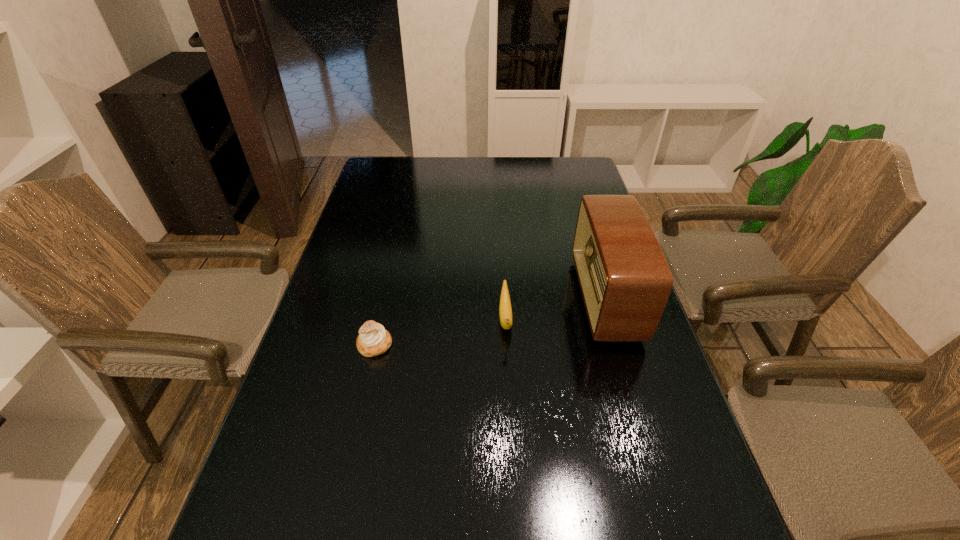
This screenshot has width=960, height=540. Find the location of `the tallest object`. the tallest object is located at coordinates (625, 280).

You are a GUI agent. You are given a task and a screenshot of the screen. Output one action in this format:
    pyautogui.click(x=<x>, y=<y>)
    Task: Click on the radio receiver
    The image size is (960, 540).
    Given the screenshot: What is the action you would take?
    pyautogui.click(x=625, y=280)

Identify the location of banana. (505, 310).

The width and height of the screenshot is (960, 540). Find the location of `pastry`. pastry is located at coordinates (373, 339).

At what (x,y) coordinates should I click in order to perform the action: click on the leftmost object. Please return your answer as a coordinate pair (x, y). Looking at the image, I should click on (373, 339).

Image resolution: width=960 pixels, height=540 pixels. Find the location of `blank space located on the front-facing side of the rightmost object`. blank space located on the front-facing side of the rightmost object is located at coordinates (506, 299).

I want to click on free spot located 0.100m on the front-facing side of the rightmost object, so click(x=542, y=299).

Find the location of `blank space located 0.150m on the front-facing side of the rightmost object`. blank space located 0.150m on the front-facing side of the rightmost object is located at coordinates (524, 299).

This screenshot has width=960, height=540. What are the coordinates of `vacant space located 0.130m at the stem of the banana` in the screenshot? It's located at (510, 392).

Identify the location of free location located on the right of the leftmost object. The height and width of the screenshot is (540, 960). (507, 345).